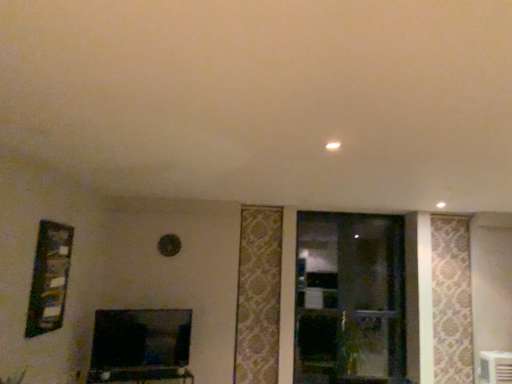
The height and width of the screenshot is (384, 512). What do you see at coordinates (349, 299) in the screenshot?
I see `transparent glass window at center` at bounding box center [349, 299].

Describe the element at coordinates (141, 339) in the screenshot. I see `matte black tv at lower center` at that location.

Where is `white plastic air conditioner at lower right`? This screenshot has width=512, height=384. white plastic air conditioner at lower right is located at coordinates (495, 367).

I want to click on wooden frame at left, so click(x=49, y=278).

The height and width of the screenshot is (384, 512). In order to click on transparent glass window at center in this screenshot , I will do `click(349, 299)`.

Considering the sizes of white plastic air conditioner at lower right and green leafy plant at center in the image, is white plastic air conditioner at lower right bigger or smaller than green leafy plant at center?

Considering their sizes, white plastic air conditioner at lower right takes up less space than green leafy plant at center.

From a real-world perspective, between white plastic air conditioner at lower right and green leafy plant at center, who is vertically higher?

In real-world perspective, white plastic air conditioner at lower right is above.

Does white plastic air conditioner at lower right have a lesser height compared to green leafy plant at center?

Yes, white plastic air conditioner at lower right is shorter than green leafy plant at center.

Is white plastic air conditioner at lower right not near green leafy plant at center?

Indeed, white plastic air conditioner at lower right is not near green leafy plant at center.

Is white plastic air conditioner at lower right in front of transparent glass window at center?

Yes.

Measure the distance between white plastic air conditioner at lower right and transparent glass window at center.

white plastic air conditioner at lower right is 5.42 feet from transparent glass window at center.

Considering the positions of point (486, 375) and point (353, 287), is point (486, 375) closer or farther from the camera than point (353, 287)?

Point (486, 375).

Is white plastic air conditioner at lower right positioned with its back to transparent glass window at center?

No, transparent glass window at center is not at the back of white plastic air conditioner at lower right.

Is the position of green leafy plant at center less distant than that of matte black tv at lower center?

That is False.

Between point (355, 332) and point (105, 343), which one is positioned behind?

The point (355, 332) is farther from the camera.

Looking at this image, is matte black tv at lower center at the back of green leafy plant at center?

green leafy plant at center does not have its back to matte black tv at lower center.

Which of these two, green leafy plant at center or matte black tv at lower center, is thinner?

matte black tv at lower center.

Looking at this image, can we say transparent glass window at center lies outside matte black tv stand at lower center?

Yes, transparent glass window at center is outside of matte black tv stand at lower center.

There is a matte black tv stand at lower center. Identify the location of window above it (from a real-world perspective). (349, 299).

Is transparent glass window at center not near matte black tv stand at lower center?

That's right, there is a large distance between transparent glass window at center and matte black tv stand at lower center.

Is point (300, 301) positioned before point (143, 369)?

That is False.

Is transparent glass window at center to the right of green leafy plant at center from the viewer's perspective?

Correct, you'll find transparent glass window at center to the right of green leafy plant at center.

From the image's perspective, who appears lower, transparent glass window at center or green leafy plant at center?

From the image's view, green leafy plant at center is below.

Image resolution: width=512 pixels, height=384 pixels. Identify the location of window above the green leafy plant at center (from a real-world perspective). (349, 299).

Is transparent glass window at center oriented towards green leafy plant at center?

Yes, transparent glass window at center is aimed at green leafy plant at center.

In terms of width, does green leafy plant at center look wider or thinner when compared to white plastic air conditioner at lower right?

green leafy plant at center is wider than white plastic air conditioner at lower right.

Measure the distance from green leafy plant at center to white plastic air conditioner at lower right.

green leafy plant at center and white plastic air conditioner at lower right are 1.40 meters apart from each other.

Would you consider green leafy plant at center to be distant from white plastic air conditioner at lower right?

Yes, green leafy plant at center is far from white plastic air conditioner at lower right.

In the scene shown: From a real-world perspective, is green leafy plant at center positioned under white plastic air conditioner at lower right based on gravity?

Yes, from a real-world perspective, green leafy plant at center is under white plastic air conditioner at lower right.

Would you say wooden frame at left is a long distance from matte black tv stand at lower center?

Yes, wooden frame at left is far from matte black tv stand at lower center.

Considering the relative sizes of wooden frame at left and matte black tv stand at lower center in the image provided, is wooden frame at left thinner than matte black tv stand at lower center?

Yes, wooden frame at left is thinner than matte black tv stand at lower center.

Can you tell me how much wooden frame at left and matte black tv stand at lower center differ in facing direction?

70 degrees.

You are a GUI agent. You are given a task and a screenshot of the screen. Output one action in this format:
    pyautogui.click(x=<x>, y=<y>)
    Task: Click on the plant below the white plastic air conditioner at lower right (from a real-world perspective)
    
    Given the screenshot: What is the action you would take?
    pyautogui.click(x=361, y=345)

At what (x,y) coordinates should I click in order to perform the action: click on window that appears behind the white plastic air conditioner at lower right. Please return your answer as a coordinate pair (x, y). The image size is (512, 384). Looking at the image, I should click on (349, 299).

Based on their spatial positions, is white plastic air conditioner at lower right or matte black tv stand at lower center further from green leafy plant at center?

Based on the image, matte black tv stand at lower center appears to be further to green leafy plant at center.

When comparing their distances from matte black tv at lower center, does green leafy plant at center or matte black tv stand at lower center seem further?

Based on the image, green leafy plant at center appears to be further to matte black tv at lower center.

Looking at the image, which one is located further to green leafy plant at center, white plastic air conditioner at lower right or wooden frame at left?

wooden frame at left lies further to green leafy plant at center than the other object.

Based on their spatial positions, is white plastic air conditioner at lower right or transparent glass window at center closer to green leafy plant at center?

transparent glass window at center is positioned closer to the anchor green leafy plant at center.

Estimate the real-world distances between objects in this image. Which object is closer to white plastic air conditioner at lower right, green leafy plant at center or matte black tv at lower center?

green leafy plant at center lies closer to white plastic air conditioner at lower right than the other object.

From the image, which object appears to be farther from wooden frame at left, matte black tv stand at lower center or matte black tv at lower center?

matte black tv stand at lower center is positioned further to the anchor wooden frame at left.

Considering their positions, is matte black tv stand at lower center positioned further to green leafy plant at center than wooden frame at left?

wooden frame at left is further to green leafy plant at center.

When comparing their distances from wooden frame at left, does transparent glass window at center or matte black tv stand at lower center seem further?

The object further to wooden frame at left is transparent glass window at center.

Find the location of a particular element. plant between matte black tv stand at lower center and transparent glass window at center is located at coordinates (361, 345).

You are a GUI agent. You are given a task and a screenshot of the screen. Output one action in this format:
    pyautogui.click(x=<x>, y=<y>)
    Task: Click on the television between wooden frame at left and transparent glass window at center
    The image size is (512, 384).
    Given the screenshot: What is the action you would take?
    pyautogui.click(x=141, y=339)

What are the coordinates of `window between green leafy plant at center and white plastic air conditioner at lower right in the horizontal direction` in the screenshot? It's located at (349, 299).

Locate an element on the screen. This screenshot has height=384, width=512. television situated between matte black tv stand at lower center and white plastic air conditioner at lower right from left to right is located at coordinates (141, 339).